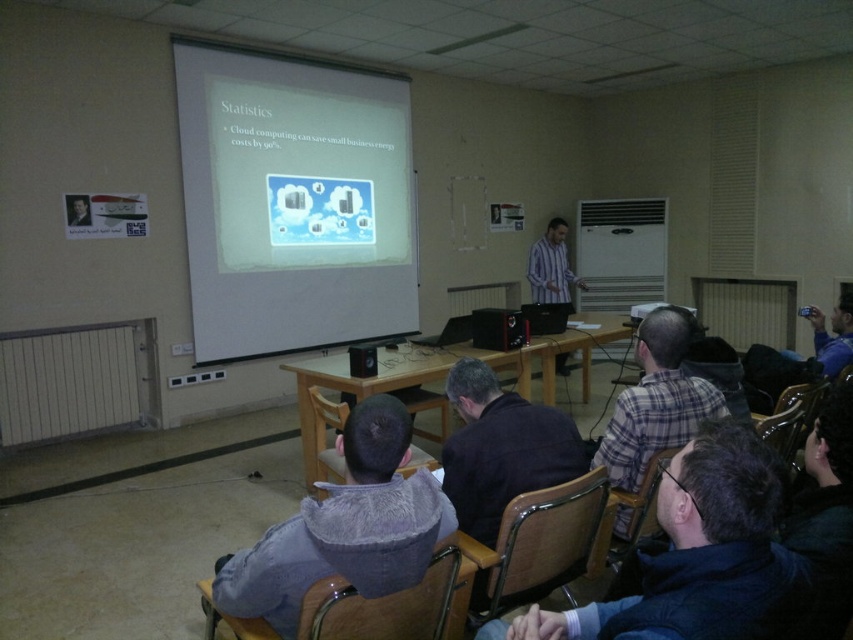
Who is lower down, gray fuzzy jacket at lower center or plaid fabric shirt at center?

gray fuzzy jacket at lower center is lower down.

Can you confirm if gray fuzzy jacket at lower center is wider than plaid fabric shirt at center?

Correct, the width of gray fuzzy jacket at lower center exceeds that of plaid fabric shirt at center.

The image size is (853, 640). I want to click on gray fuzzy jacket at lower center, so click(x=344, y=528).

Is gray fuzzy jacket at lower center to the left of striped shirt at center from the viewer's perspective?

Indeed, gray fuzzy jacket at lower center is positioned on the left side of striped shirt at center.

Which is in front, point (413, 557) or point (531, 252)?

Point (413, 557)

Is point (358, 490) closer to viewer compared to point (544, 237)?

Yes, it is in front of point (544, 237).

The height and width of the screenshot is (640, 853). What are the coordinates of `gray fuzzy jacket at lower center` in the screenshot? It's located at (344, 528).

Is gray fuzzy jacket at lower center closer to the viewer compared to dark blue fabric at center?

Yes, gray fuzzy jacket at lower center is in front of dark blue fabric at center.

Can you confirm if gray fuzzy jacket at lower center is taller than dark blue fabric at center?

Incorrect, gray fuzzy jacket at lower center's height is not larger of dark blue fabric at center's.

Describe the element at coordinates (344, 528) in the screenshot. The height and width of the screenshot is (640, 853). I see `gray fuzzy jacket at lower center` at that location.

Identify the location of gray fuzzy jacket at lower center. (x=344, y=528).